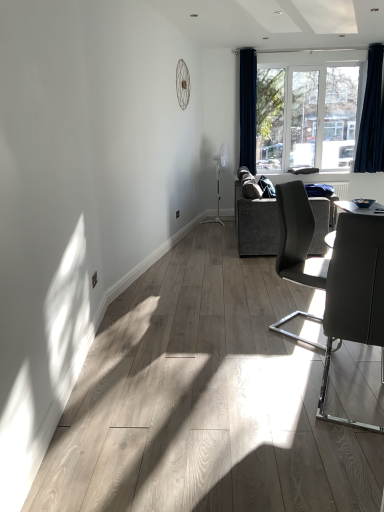
Question: From the image's perspective, is dark gray fabric couch at center-right under clear glass window at upper center?

Choices:
 (A) yes
 (B) no

Answer: (A)

Question: Is dark gray fabric couch at center-right positioned in front of clear glass window at upper center?

Choices:
 (A) yes
 (B) no

Answer: (A)

Question: Can you confirm if dark gray fabric couch at center-right is wider than clear glass window at upper center?

Choices:
 (A) no
 (B) yes

Answer: (B)

Question: Can you confirm if dark gray fabric couch at center-right is bigger than clear glass window at upper center?

Choices:
 (A) no
 (B) yes

Answer: (B)

Question: Is dark gray fabric couch at center-right beside clear glass window at upper center?

Choices:
 (A) yes
 (B) no

Answer: (B)

Question: From a real-world perspective, is dark gray fabric couch at center-right below clear glass window at upper center?

Choices:
 (A) yes
 (B) no

Answer: (A)

Question: Is dark gray fabric couch at center-right bigger than matte gray chair at right, the 1th chair in the front-to-back sequence?

Choices:
 (A) yes
 (B) no

Answer: (A)

Question: From the image's perspective, is dark gray fabric couch at center-right below matte gray chair at right, the 1th chair in the front-to-back sequence?

Choices:
 (A) no
 (B) yes

Answer: (A)

Question: Is dark gray fabric couch at center-right shorter than matte gray chair at right, the second chair when ordered from back to front?

Choices:
 (A) yes
 (B) no

Answer: (A)

Question: Is dark gray fabric couch at center-right further to the viewer compared to matte gray chair at right, the second chair when ordered from back to front?

Choices:
 (A) no
 (B) yes

Answer: (B)

Question: Does dark gray fabric couch at center-right appear on the right side of matte gray chair at right, the 1th chair in the front-to-back sequence?

Choices:
 (A) yes
 (B) no

Answer: (A)

Question: Does dark gray fabric couch at center-right come in front of matte gray chair at right, the second chair when ordered from back to front?

Choices:
 (A) yes
 (B) no

Answer: (B)

Question: Is dark gray fabric couch at center-right surrounded by clear glass window at upper center?

Choices:
 (A) yes
 (B) no

Answer: (B)